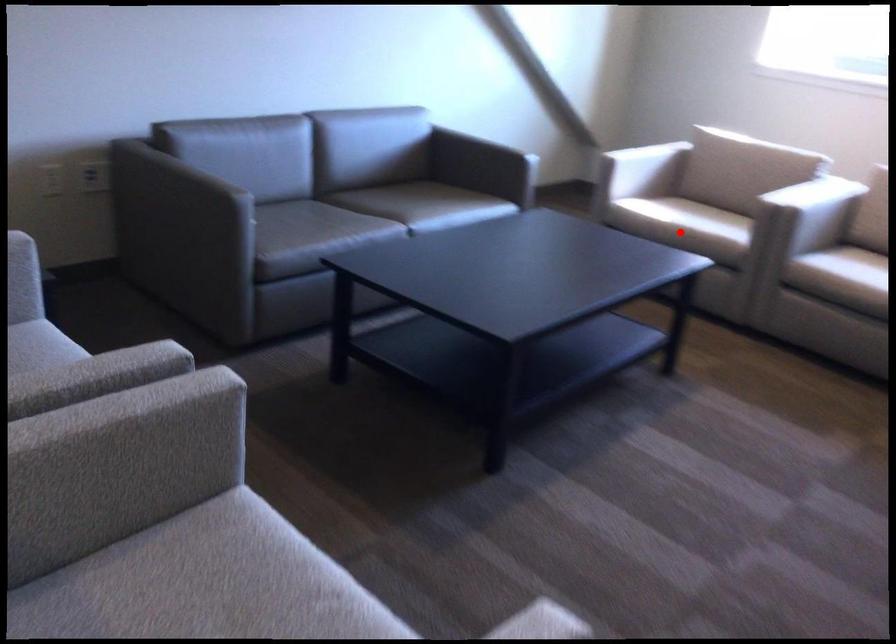
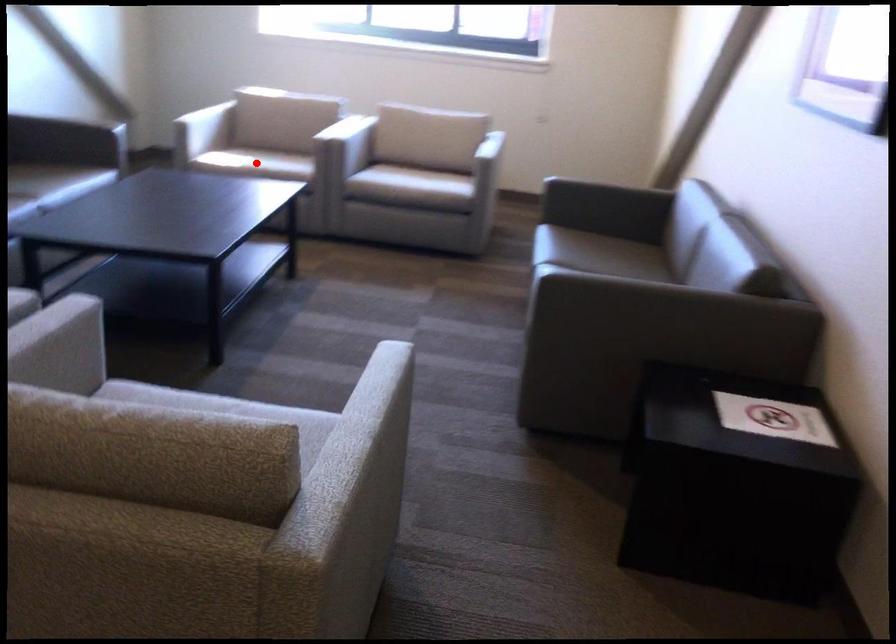
I am providing you with two images of the same scene from different viewpoints. A red point is marked on the first image and another point is marked on the second image. Are the points marked in image1 and image2 representing the same 3D position?

Yes